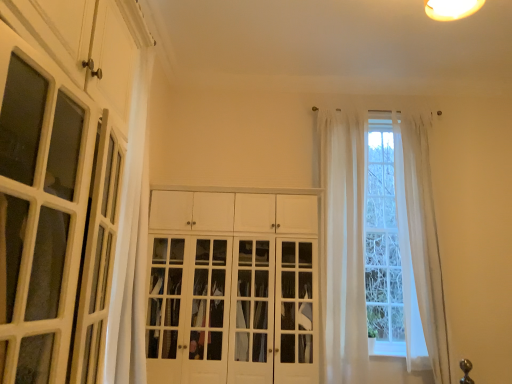
Question: Can white glossy cabinet doors at center be found inside white sheer curtain at right, the second curtain in the left-to-right sequence?

Choices:
 (A) no
 (B) yes

Answer: (A)

Question: Is white glossy cabinet doors at center at the back of white sheer curtain at right, the second curtain in the left-to-right sequence?

Choices:
 (A) no
 (B) yes

Answer: (A)

Question: Is white sheer curtain at right, the second curtain in the left-to-right sequence, thinner than white glossy cabinet doors at center?

Choices:
 (A) yes
 (B) no

Answer: (A)

Question: Is white sheer curtain at right, the second curtain in the left-to-right sequence, completely or partially outside of white glossy cabinet doors at center?

Choices:
 (A) yes
 (B) no

Answer: (A)

Question: Considering the relative sizes of white sheer curtain at right, which appears as the 1th curtain when viewed from the right, and white glossy cabinet doors at center in the image provided, is white sheer curtain at right, which appears as the 1th curtain when viewed from the right, taller than white glossy cabinet doors at center?

Choices:
 (A) yes
 (B) no

Answer: (A)

Question: From the image's perspective, is white sheer curtain at right, the second curtain in the left-to-right sequence, below white glossy cabinet doors at center?

Choices:
 (A) yes
 (B) no

Answer: (B)

Question: Considering the relative sizes of white glossy cabinet doors at center and white glossy cabinet at left in the image provided, is white glossy cabinet doors at center wider than white glossy cabinet at left?

Choices:
 (A) yes
 (B) no

Answer: (A)

Question: Considering the relative positions of white glossy cabinet doors at center and white glossy cabinet at left in the image provided, is white glossy cabinet doors at center to the left of white glossy cabinet at left from the viewer's perspective?

Choices:
 (A) yes
 (B) no

Answer: (B)

Question: Is the position of white glossy cabinet doors at center more distant than that of white glossy cabinet at left?

Choices:
 (A) yes
 (B) no

Answer: (A)

Question: Is white glossy cabinet doors at center located outside white glossy cabinet at left?

Choices:
 (A) yes
 (B) no

Answer: (A)

Question: Is white glossy cabinet doors at center bigger than white glossy cabinet at left?

Choices:
 (A) yes
 (B) no

Answer: (A)

Question: Is white glossy cabinet doors at center in contact with white glossy cabinet at left?

Choices:
 (A) yes
 (B) no

Answer: (B)

Question: Considering the relative positions of sheer white curtain at center, which appears as the second curtain when viewed from the right, and white glossy cabinet doors at center in the image provided, is sheer white curtain at center, which appears as the second curtain when viewed from the right, in front of white glossy cabinet doors at center?

Choices:
 (A) no
 (B) yes

Answer: (A)